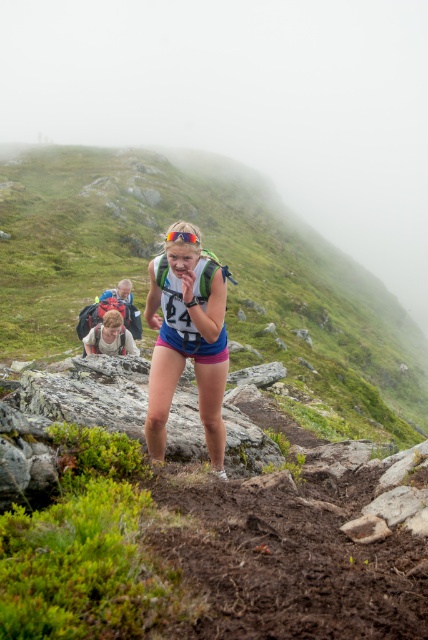
Question: Which point appears farthest from the camera in this image?

Choices:
 (A) 121,305
 (B) 151,376
 (C) 121,332

Answer: (A)

Question: Does matte gray backpack at lower left have a larger size compared to matte blue backpack at center?

Choices:
 (A) yes
 (B) no

Answer: (B)

Question: Which of these objects is positioned closest to the matte blue backpack at center?

Choices:
 (A) matte blue shorts at center
 (B) matte gray backpack at lower left

Answer: (B)

Question: Which point is farther from the camera taking this photo?

Choices:
 (A) (133, 308)
 (B) (115, 349)

Answer: (A)

Question: Does matte gray backpack at lower left appear on the left side of matte blue backpack at center?

Choices:
 (A) yes
 (B) no

Answer: (B)

Question: Is matte blue shorts at center bigger than matte gray backpack at lower left?

Choices:
 (A) yes
 (B) no

Answer: (B)